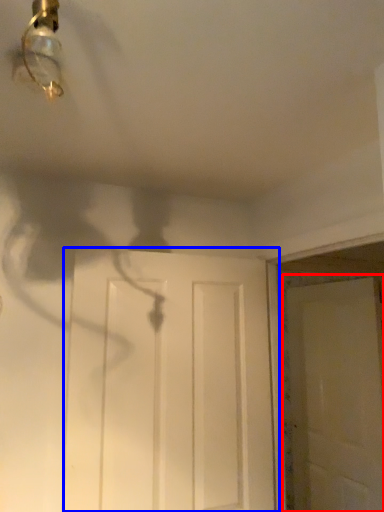
Question: Which point is further to the camera, door (highlighted by a red box) or door (highlighted by a blue box)?

Choices:
 (A) door
 (B) door

Answer: (A)